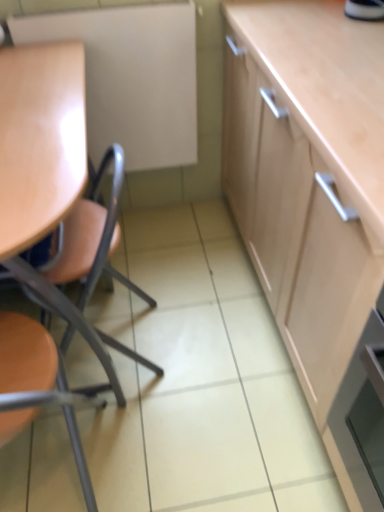
What do you see at coordinates (132, 78) in the screenshot? This screenshot has width=384, height=512. I see `matte white board at upper left` at bounding box center [132, 78].

At what (x,y) coordinates should I click in order to perform the action: click on matte white board at upper left. Please return your answer as a coordinate pair (x, y). Image resolution: width=384 pixels, height=512 pixels. Looking at the image, I should click on (132, 78).

In the image, is matte wood chair at left, positioned as the second chair in bottom-to-top order, on the left side or the right side of matte white board at upper left?

matte wood chair at left, positioned as the second chair in bottom-to-top order, is to the left of matte white board at upper left.

Locate an element on the screen. Image resolution: width=384 pixels, height=512 pixels. the 1st chair counting from the left side of the matte white board at upper left is located at coordinates (86, 272).

From a real-world perspective, which is physically below, matte wood chair at left, acting as the first chair starting from the top, or matte white board at upper left?

In real-world perspective, matte wood chair at left, acting as the first chair starting from the top, is lower.

Considering the relative sizes of matte wood chair at left, acting as the first chair starting from the top, and matte white board at upper left in the image provided, is matte wood chair at left, acting as the first chair starting from the top, thinner than matte white board at upper left?

In fact, matte wood chair at left, acting as the first chair starting from the top, might be wider than matte white board at upper left.

From a real-world perspective, who is located lower, matte white board at upper left or matte wood chair at left, acting as the first chair starting from the top?

In real-world perspective, matte wood chair at left, acting as the first chair starting from the top, is lower.

From the picture: Would you say matte white board at upper left is inside or outside matte wood chair at left, positioned as the second chair in bottom-to-top order?

matte white board at upper left is outside matte wood chair at left, positioned as the second chair in bottom-to-top order.

Which is behind, point (112, 119) or point (107, 264)?

The point (107, 264) is more distant.

Can you confirm if matte white board at upper left is bigger than matte wood chair at left, positioned as the second chair in bottom-to-top order?

Incorrect, matte white board at upper left is not larger than matte wood chair at left, positioned as the second chair in bottom-to-top order.

Considering the positions of objects matte white board at upper left and matte orange chair at left, arranged as the 1th chair when ordered from the bottom, in the image provided, who is more to the left, matte white board at upper left or matte orange chair at left, arranged as the 1th chair when ordered from the bottom,?

From the viewer's perspective, matte orange chair at left, arranged as the 1th chair when ordered from the bottom, appears more on the left side.

Is matte white board at upper left oriented towards matte orange chair at left, which is the 2th chair from top to bottom?

Yes.

How different are the orientations of matte white board at upper left and matte orange chair at left, which is the 2th chair from top to bottom, in degrees?

The angular difference between matte white board at upper left and matte orange chair at left, which is the 2th chair from top to bottom, is 179 degrees.

Can you confirm if matte orange chair at left, arranged as the 1th chair when ordered from the bottom, is thinner than matte white board at upper left?

No, matte orange chair at left, arranged as the 1th chair when ordered from the bottom, is not thinner than matte white board at upper left.

Is matte orange chair at left, arranged as the 1th chair when ordered from the bottom, positioned before matte white board at upper left?

Yes, it is.

From a real-world perspective, between matte orange chair at left, arranged as the 1th chair when ordered from the bottom, and matte white board at upper left, who is vertically lower?

In real-world perspective, matte orange chair at left, arranged as the 1th chair when ordered from the bottom, is lower.

Would you say matte orange chair at left, which is the 2th chair from top to bottom, is outside matte white board at upper left?

Indeed, matte orange chair at left, which is the 2th chair from top to bottom, is completely outside matte white board at upper left.

Is matte orange chair at left, which is the 2th chair from top to bottom, aimed at matte wood chair at left, acting as the first chair starting from the top?

Yes, matte orange chair at left, which is the 2th chair from top to bottom, faces towards matte wood chair at left, acting as the first chair starting from the top.

From a real-world perspective, is matte orange chair at left, arranged as the 1th chair when ordered from the bottom, located beneath matte wood chair at left, positioned as the second chair in bottom-to-top order?

Indeed, from a real-world perspective, matte orange chair at left, arranged as the 1th chair when ordered from the bottom, is positioned beneath matte wood chair at left, positioned as the second chair in bottom-to-top order.

The width and height of the screenshot is (384, 512). I want to click on chair lying below the matte wood chair at left, acting as the first chair starting from the top (from the image's perspective), so click(x=26, y=355).

Which is more to the right, matte orange chair at left, which is the 2th chair from top to bottom, or matte wood chair at left, positioned as the second chair in bottom-to-top order?

Positioned to the right is matte wood chair at left, positioned as the second chair in bottom-to-top order.

From the picture: Is matte wood chair at left, positioned as the second chair in bottom-to-top order, next to matte orange chair at left, which is the 2th chair from top to bottom?

matte wood chair at left, positioned as the second chair in bottom-to-top order, is not next to matte orange chair at left, which is the 2th chair from top to bottom, and they're not touching.

How far apart are matte wood chair at left, acting as the first chair starting from the top, and matte orange chair at left, arranged as the 1th chair when ordered from the bottom?

They are 8.55 inches apart.

Does point (87, 288) come farther from viewer compared to point (5, 372)?

Yes, it is behind point (5, 372).

The height and width of the screenshot is (512, 384). I want to click on appliance that is behind the matte wood chair at left, acting as the first chair starting from the top, so click(132, 78).

Image resolution: width=384 pixels, height=512 pixels. In order to click on the 1st chair in front of the matte white board at upper left, starting your count from the anchor in this screenshot , I will do `click(86, 272)`.

Considering their positions, is matte wood chair at left, positioned as the second chair in bottom-to-top order, positioned closer to matte white board at upper left than matte orange chair at left, arranged as the 1th chair when ordered from the bottom?

matte wood chair at left, positioned as the second chair in bottom-to-top order, is closer to matte white board at upper left.

Considering their positions, is matte wood chair at left, positioned as the second chair in bottom-to-top order, positioned closer to matte orange chair at left, which is the 2th chair from top to bottom, than matte white board at upper left?

Based on the image, matte wood chair at left, positioned as the second chair in bottom-to-top order, appears to be nearer to matte orange chair at left, which is the 2th chair from top to bottom.

Estimate the real-world distances between objects in this image. Which object is closer to matte white board at upper left, matte orange chair at left, arranged as the 1th chair when ordered from the bottom, or matte wood chair at left, positioned as the second chair in bottom-to-top order?

matte wood chair at left, positioned as the second chair in bottom-to-top order.

Based on their spatial positions, is matte white board at upper left or matte orange chair at left, which is the 2th chair from top to bottom, closer to matte wood chair at left, acting as the first chair starting from the top?

Based on the image, matte orange chair at left, which is the 2th chair from top to bottom, appears to be nearer to matte wood chair at left, acting as the first chair starting from the top.

From the picture: Looking at the image, which one is located further to matte orange chair at left, arranged as the 1th chair when ordered from the bottom, matte white board at upper left or matte wood chair at left, positioned as the second chair in bottom-to-top order?

matte white board at upper left is positioned further to the anchor matte orange chair at left, arranged as the 1th chair when ordered from the bottom.

Considering their positions, is matte orange chair at left, arranged as the 1th chair when ordered from the bottom, positioned closer to matte wood chair at left, positioned as the second chair in bottom-to-top order, than matte white board at upper left?

The object closer to matte wood chair at left, positioned as the second chair in bottom-to-top order, is matte orange chair at left, arranged as the 1th chair when ordered from the bottom.

The height and width of the screenshot is (512, 384). Identify the location of chair between matte white board at upper left and matte orange chair at left, which is the 2th chair from top to bottom, from top to bottom. (86, 272).